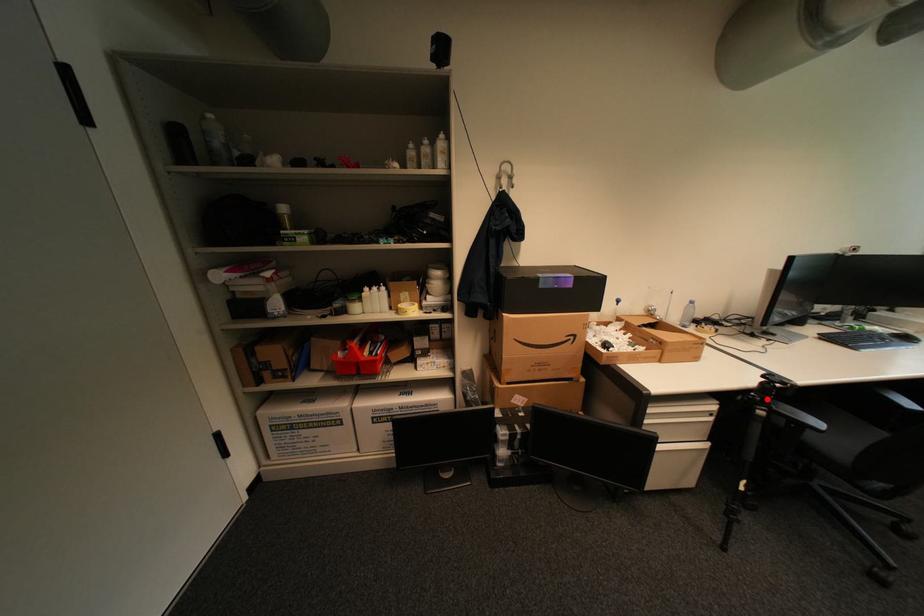
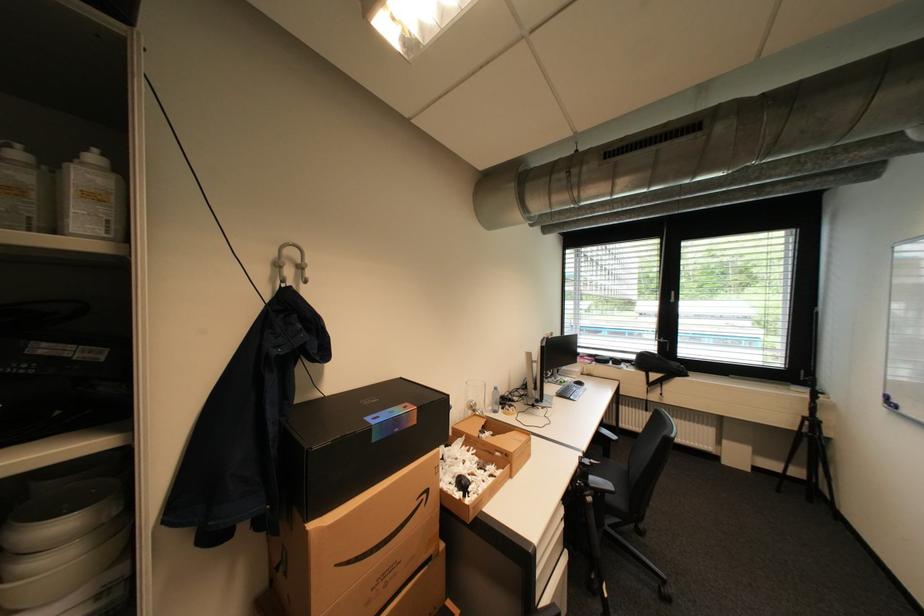
The point at the highlighted location is marked in the first image. Where is the corresponding point in the second image?

(591, 485)